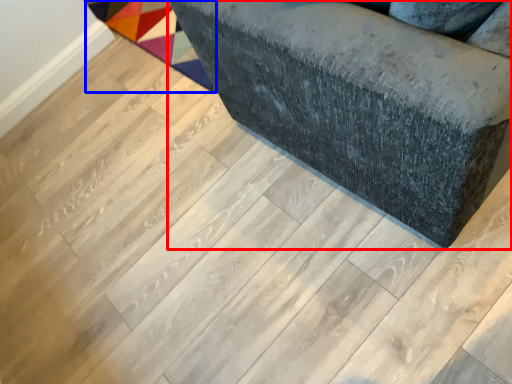
Question: Which point is closer to the camera, furniture (highlighted by a red box) or mat (highlighted by a blue box)?

Choices:
 (A) furniture
 (B) mat

Answer: (A)